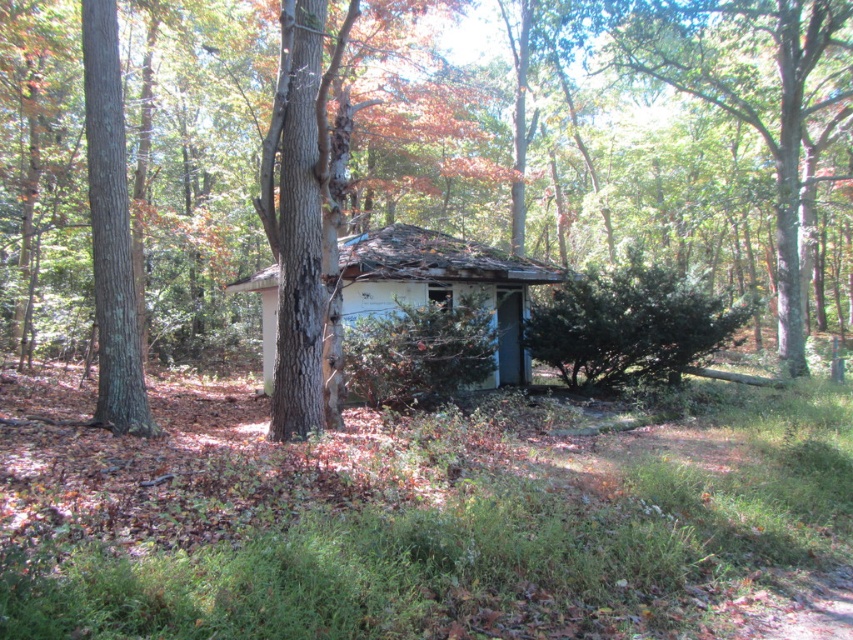
You are standing in a forest during autumn and see a brown rough tree at center and a white weathered hut at center. Which object is positioned higher relative to the other?

The brown rough tree at center is located above the white weathered hut at center, so it is positioned higher.

You are standing at the entrance of the weathered structure and want to place a small bench exactly at the coordinates given for the brown rough tree at center. Is the ground at that location flat enough for the bench?

The brown rough tree at center is located at point (509, 172), but the ground around the structure is described as uneven. Therefore, the ground at that location may not be flat enough for the bench.